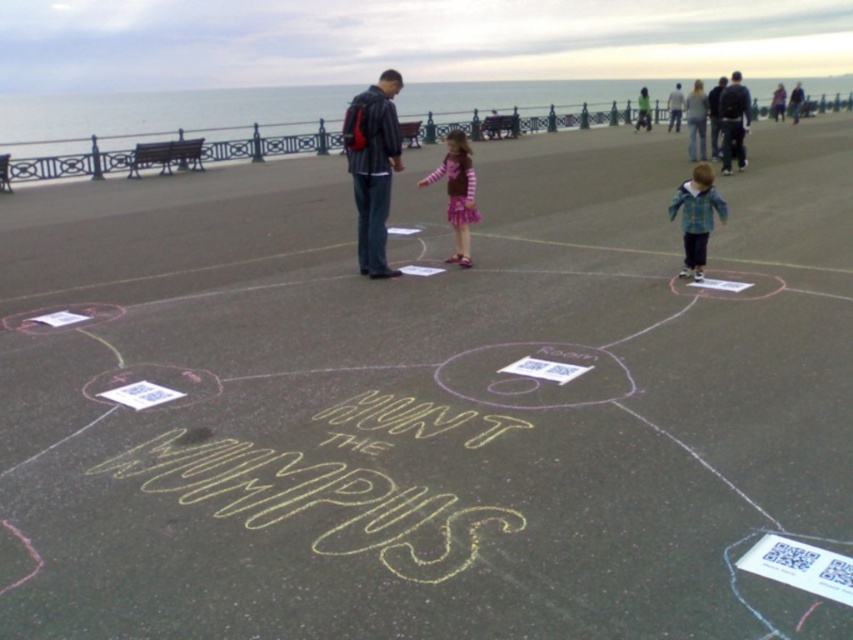
Between yellow chalk writing at center and plaid fabric jacket at center, which one has more height?

Standing taller between the two is plaid fabric jacket at center.

Can you confirm if yellow chalk writing at center is smaller than plaid fabric jacket at center?

Actually, yellow chalk writing at center might be larger than plaid fabric jacket at center.

Where is `yellow chalk writing at center`? This screenshot has height=640, width=853. yellow chalk writing at center is located at coordinates (317, 500).

Who is more distant from viewer, (149, 464) or (669, 120)?

The point (669, 120) is behind.

From the picture: Between yellow chalk writing at center and light gray shirt at center, which one is positioned higher?

light gray shirt at center is above.

Image resolution: width=853 pixels, height=640 pixels. What do you see at coordinates (317, 500) in the screenshot? I see `yellow chalk writing at center` at bounding box center [317, 500].

This screenshot has width=853, height=640. I want to click on yellow chalk writing at center, so click(x=317, y=500).

Between matte black jacket at center and striped fabric dress at center, which one appears on the left side from the viewer's perspective?

Positioned to the left is matte black jacket at center.

Where is `matte black jacket at center`? matte black jacket at center is located at coordinates (373, 166).